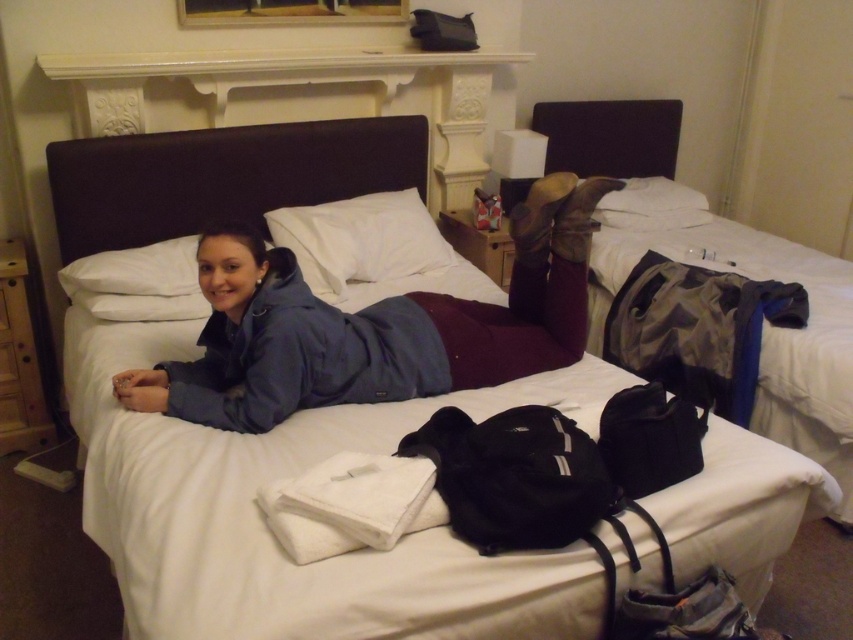
You are a hotel staff member checking the room. You need to ensure that all items on the bed are within the bed area. The bed is rectangular. Can you confirm if the blue fabric jacket at center is entirely within the boundaries of the dark brown leather bed at right?

The blue fabric jacket at center might be wider than dark brown leather bed at right, so there is a possibility that part of the jacket extends beyond the bed area. Further inspection is needed to confirm.

You are a hotel housekeeper who needs to clean the bed area. The blue fabric jacket at center is currently blocking access to the dark brown leather bed at right. Can you lift the jacket and move it aside without needing assistance, considering the space between them?

The distance between the blue fabric jacket at center and the dark brown leather bed at right is 1.21 meters. Since the jacket is not too heavy and the space is sufficient, you can easily lift and move it aside without assistance.